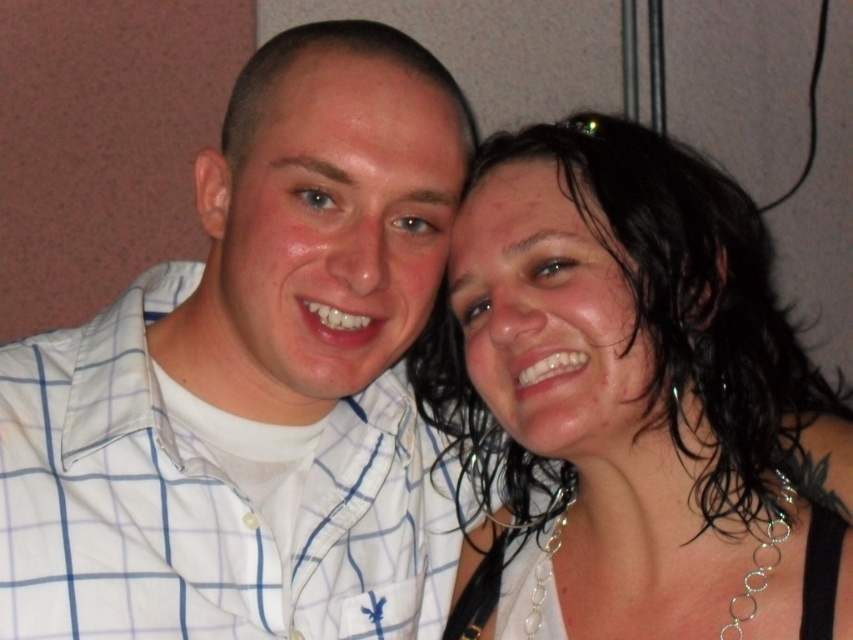
You are a photographer adjusting the camera settings to ensure both the wet hair at center and the matte white shirt at center are clearly visible. Given their sizes, which object should you focus on first to capture sharp details?

The wet hair at center is bigger than the matte white shirt at center, so you should focus on the wet hair at center first to ensure its larger details are sharp before adjusting for the smaller matte white shirt at center.

You are a photographer adjusting the camera settings to ensure both the wet hair at center and the matte white shirt at center are in focus. Given that the camera can only focus on objects within a 10 cm width range, can both objects be captured clearly?

The wet hair at center has a larger width than the matte white shirt at center. Since the camera requires a 10 cm width range to focus on both, but the difference in their widths might exceed this limit, it might not be possible. However, without exact measurements, it is uncertain.